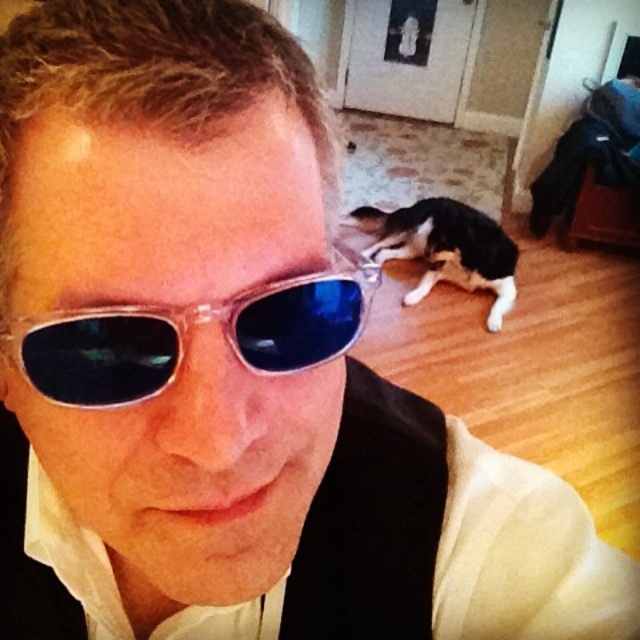
You are holding a 10.5 inch ruler and want to measure the distance from the camera to the point at coordinates point (97,307). Can your ruler reach that point?

The distance of point (97,307) from camera is 10.90 inches, so the ruler cannot reach it since it is shorter than the required distance.

You are a photographer setting up a shoot in the described scene. You need to position a small prop between the transparent plastic sunglasses at center and the black and white fur at lower center. Based on their positions, which side of the prop should face the sunglasses?

The transparent plastic sunglasses at center is to the left of black and white fur at lower center, so the left side of the prop should face the sunglasses.